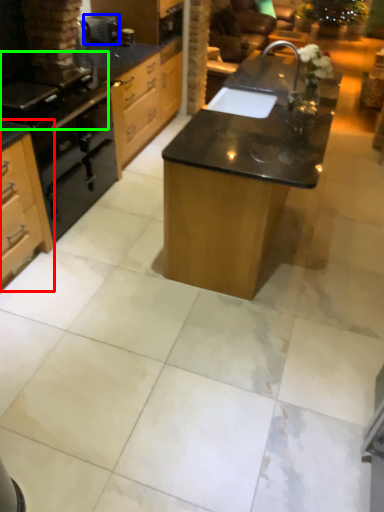
Question: Based on their relative distances, which object is farther from cabinetry (highlighted by a red box)? Choose from appliance (highlighted by a blue box) and gas stove (highlighted by a green box).

Choices:
 (A) appliance
 (B) gas stove

Answer: (A)